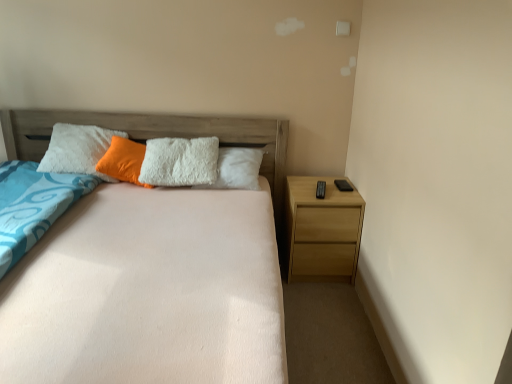
Question: Is light brown wood nightstand at right oriented away from peach soft fabric bed at center?

Choices:
 (A) no
 (B) yes

Answer: (A)

Question: Does light brown wood nightstand at right have a lesser height compared to peach soft fabric bed at center?

Choices:
 (A) no
 (B) yes

Answer: (B)

Question: Is light brown wood nightstand at right taller than peach soft fabric bed at center?

Choices:
 (A) yes
 (B) no

Answer: (B)

Question: Could you tell me if light brown wood nightstand at right is turned towards peach soft fabric bed at center?

Choices:
 (A) yes
 (B) no

Answer: (B)

Question: Is light brown wood nightstand at right positioned before peach soft fabric bed at center?

Choices:
 (A) no
 (B) yes

Answer: (A)

Question: Does light brown wood nightstand at right have a smaller size compared to peach soft fabric bed at center?

Choices:
 (A) no
 (B) yes

Answer: (B)

Question: Does peach soft fabric bed at center lie in front of light brown wood nightstand at right?

Choices:
 (A) no
 (B) yes

Answer: (B)

Question: Is peach soft fabric bed at center turned away from light brown wood nightstand at right?

Choices:
 (A) yes
 (B) no

Answer: (B)

Question: Is the position of peach soft fabric bed at center more distant than that of light brown wood nightstand at right?

Choices:
 (A) no
 (B) yes

Answer: (A)

Question: Does peach soft fabric bed at center have a lesser height compared to light brown wood nightstand at right?

Choices:
 (A) yes
 (B) no

Answer: (B)

Question: Considering the relative sizes of peach soft fabric bed at center and light brown wood nightstand at right in the image provided, is peach soft fabric bed at center wider than light brown wood nightstand at right?

Choices:
 (A) yes
 (B) no

Answer: (A)

Question: Is peach soft fabric bed at center far away from light brown wood nightstand at right?

Choices:
 (A) no
 (B) yes

Answer: (A)

Question: From the image's perspective, is light brown wood nightstand at right on top of orange fuzzy pillow at center?

Choices:
 (A) no
 (B) yes

Answer: (A)